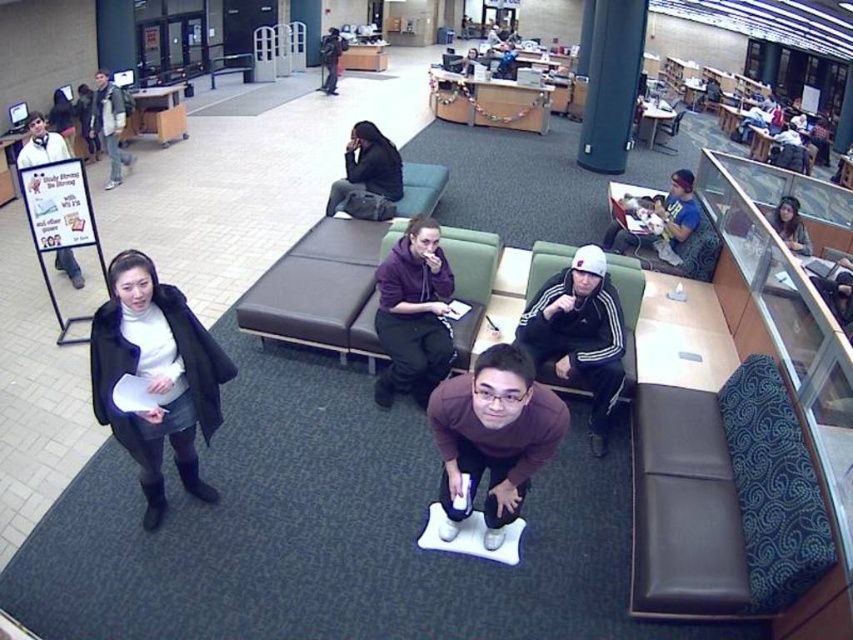
Does black fleece jacket at center appear over dark gray fabric jacket at center?

Incorrect, black fleece jacket at center is not positioned above dark gray fabric jacket at center.

Consider the image. Can you confirm if black fleece jacket at center is wider than dark gray fabric jacket at center?

No, black fleece jacket at center is not wider than dark gray fabric jacket at center.

What are the coordinates of `black fleece jacket at center` in the screenshot? It's located at (579, 333).

Who is more forward, (421, 388) or (109, 172)?

Positioned in front is point (421, 388).

Identify the location of purple fleece jacket at center. This screenshot has height=640, width=853. (413, 314).

Can you confirm if patterned fabric cushion at lower right is positioned above white paper sign at left?

No.

This screenshot has width=853, height=640. Describe the element at coordinates (724, 499) in the screenshot. I see `patterned fabric cushion at lower right` at that location.

Is point (708, 500) closer to viewer compared to point (27, 148)?

Yes, it is in front of point (27, 148).

Locate an element on the screen. The image size is (853, 640). patterned fabric cushion at lower right is located at coordinates tap(724, 499).